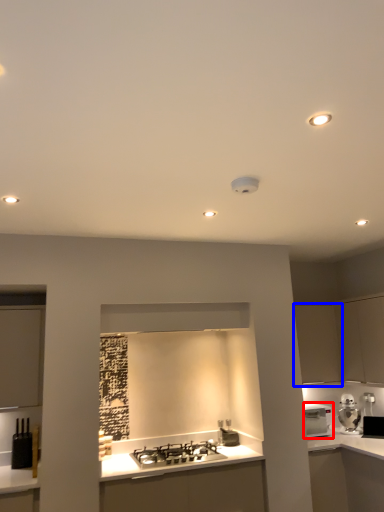
Question: Which object is closer to the camera taking this photo, home appliance (highlighted by a red box) or cabinetry (highlighted by a blue box)?

Choices:
 (A) home appliance
 (B) cabinetry

Answer: (A)